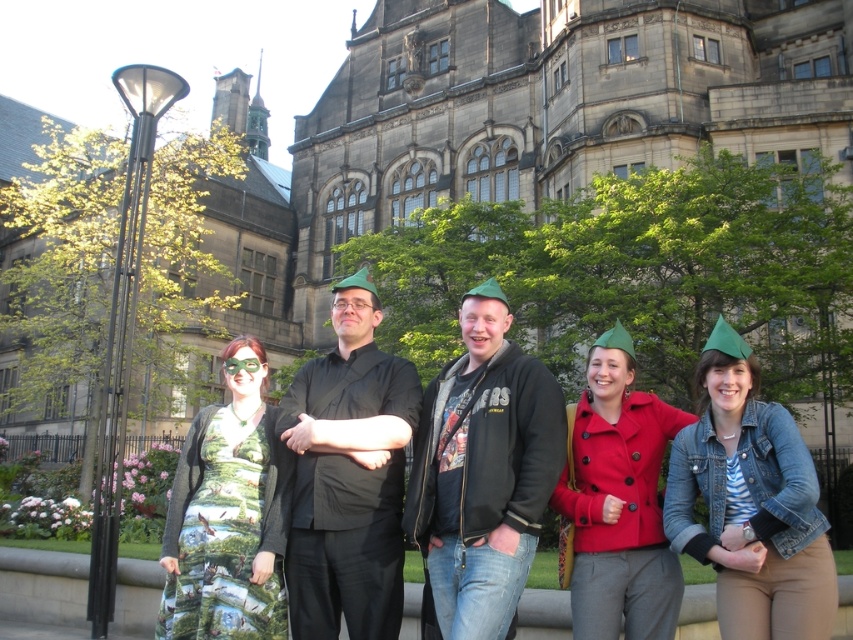
Question: Does matte black jacket at center appear under printed fabric dress at center?

Choices:
 (A) yes
 (B) no

Answer: (B)

Question: Which point is farther to the camera?

Choices:
 (A) (479, 524)
 (B) (178, 499)

Answer: (B)

Question: Among these objects, which one is nearest to the camera?

Choices:
 (A) black matte shirt at center
 (B) denim jacket at lower right

Answer: (B)

Question: Is matte black jacket at center smaller than matte green hat at center?

Choices:
 (A) no
 (B) yes

Answer: (A)

Question: Which of the following is the farthest from the observer?

Choices:
 (A) (263, 428)
 (B) (439, 531)
 (C) (555, 499)
 (D) (722, 506)

Answer: (A)

Question: Is denim jacket at lower right smaller than matte green hat at center?

Choices:
 (A) no
 (B) yes

Answer: (B)